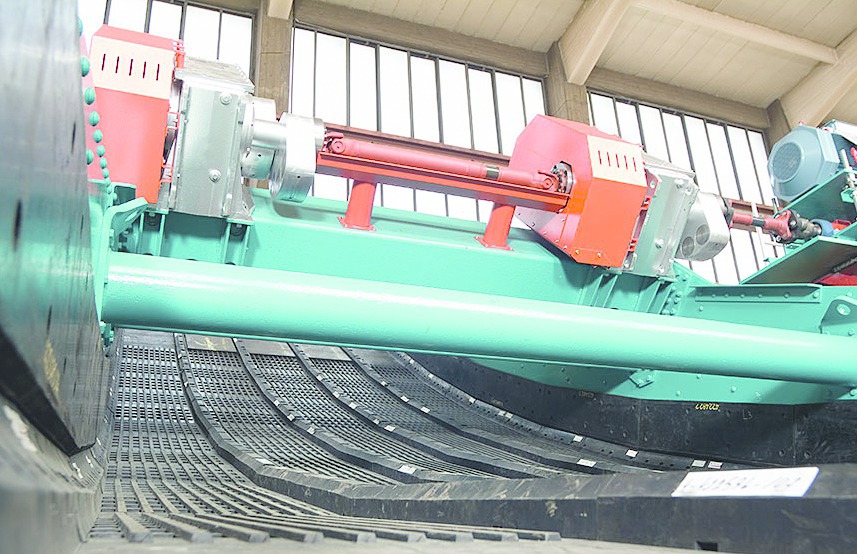
You are a GUI agent. You are given a task and a screenshot of the screen. Output one action in this format:
    pyautogui.click(x=<x>, y=<y>)
    Task: Click on the fan
    This screenshot has width=857, height=554.
    Given the screenshot: What is the action you would take?
    pyautogui.click(x=782, y=163)